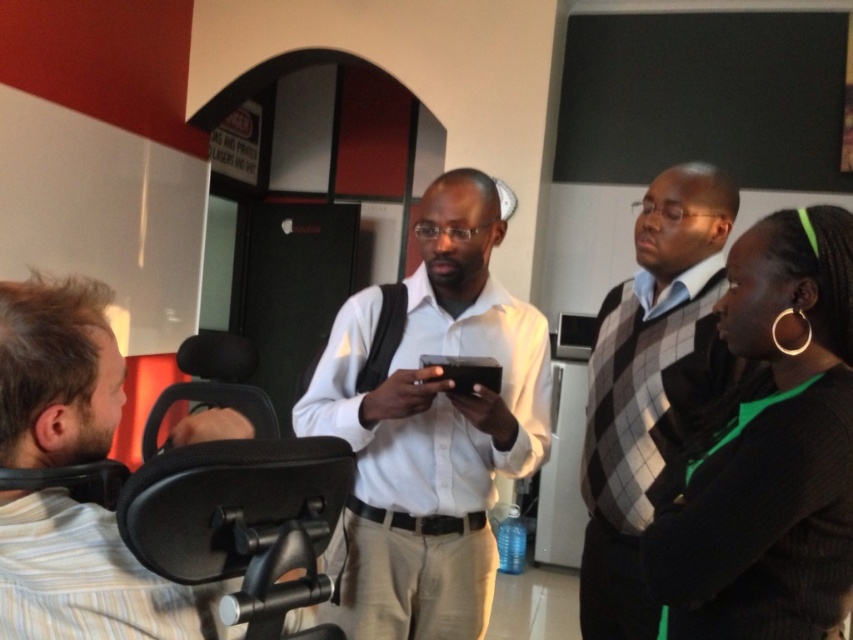
Question: Which of the following is the farthest from the observer?

Choices:
 (A) click(776, 419)
 (B) click(357, 408)

Answer: (B)

Question: Is white matte shirt at center wider than light brown striped shirt at left?

Choices:
 (A) no
 (B) yes

Answer: (B)

Question: Does black knitwear at right appear over light brown striped shirt at left?

Choices:
 (A) yes
 (B) no

Answer: (B)

Question: Among these points, which one is farthest from the camera?

Choices:
 (A) (38, 436)
 (B) (817, 483)
 (C) (606, 410)

Answer: (C)

Question: Which is nearer to the white matte shirt at center?

Choices:
 (A) gray checkered sweater at center
 (B) light brown striped shirt at left
 (C) black knitwear at right

Answer: (A)

Question: Is black knitwear at right smaller than light brown striped shirt at left?

Choices:
 (A) no
 (B) yes

Answer: (A)